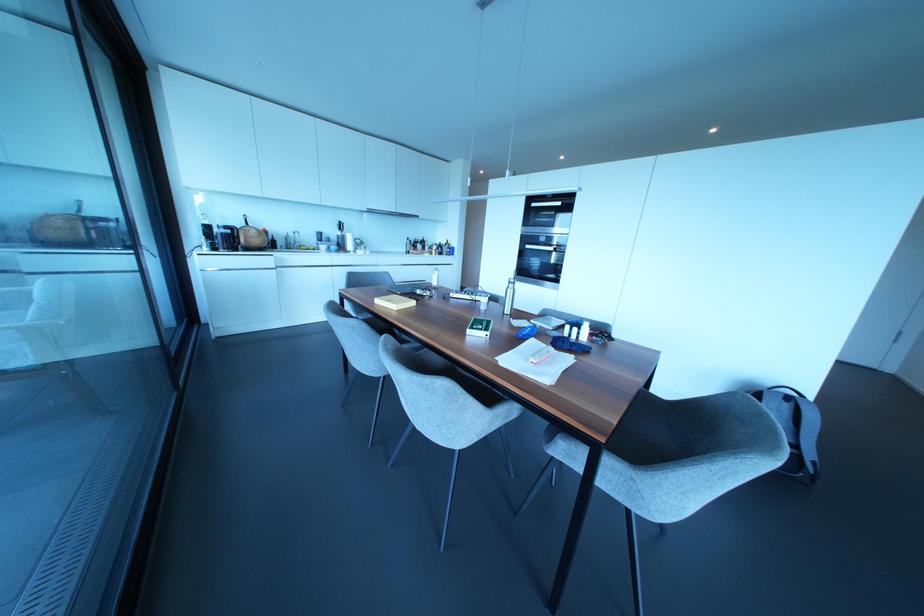
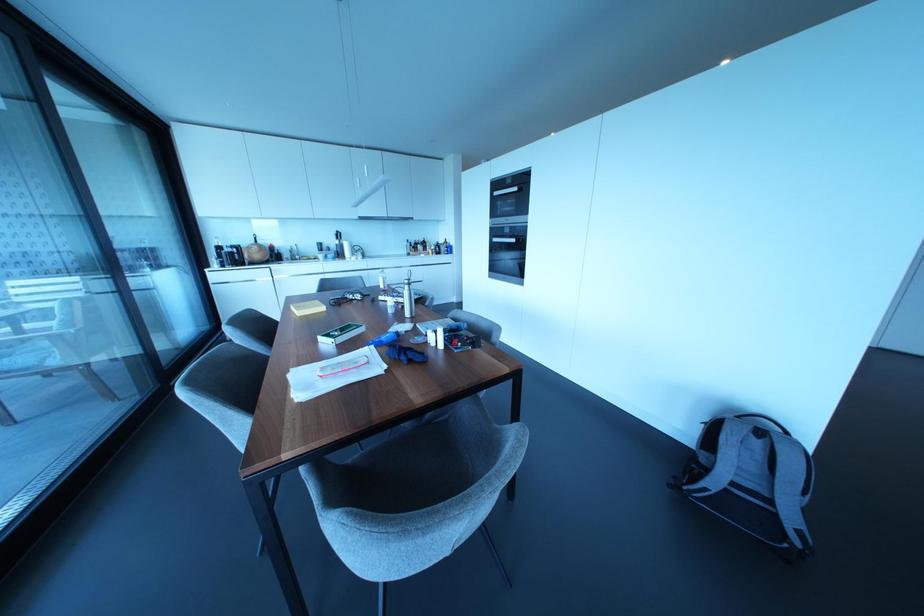
Find the pixel in the second image that matches point (428, 293) in the first image.

(358, 296)